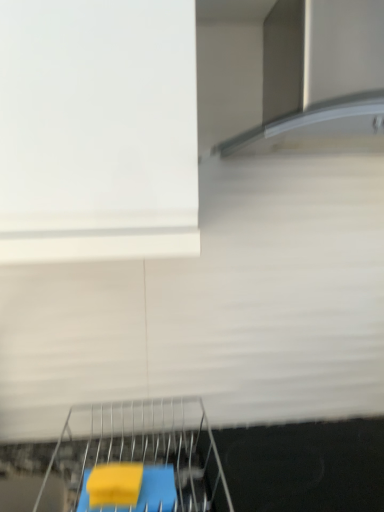
Question: Considering the positions of satin silver exhaust hood at upper center and metal wire rack at lower center in the image, is satin silver exhaust hood at upper center taller or shorter than metal wire rack at lower center?

Choices:
 (A) tall
 (B) short

Answer: (A)

Question: In the image, is satin silver exhaust hood at upper center on the left side or the right side of metal wire rack at lower center?

Choices:
 (A) right
 (B) left

Answer: (A)

Question: Considering their positions, is satin silver exhaust hood at upper center located in front of or behind metal wire rack at lower center?

Choices:
 (A) behind
 (B) front

Answer: (B)

Question: Is metal wire rack at lower center taller or shorter than satin silver exhaust hood at upper center?

Choices:
 (A) short
 (B) tall

Answer: (A)

Question: Looking at their shapes, would you say metal wire rack at lower center is wider or thinner than satin silver exhaust hood at upper center?

Choices:
 (A) thin
 (B) wide

Answer: (B)

Question: From the image's perspective, is metal wire rack at lower center located above or below satin silver exhaust hood at upper center?

Choices:
 (A) below
 (B) above

Answer: (A)

Question: In terms of size, does metal wire rack at lower center appear bigger or smaller than satin silver exhaust hood at upper center?

Choices:
 (A) small
 (B) big

Answer: (A)